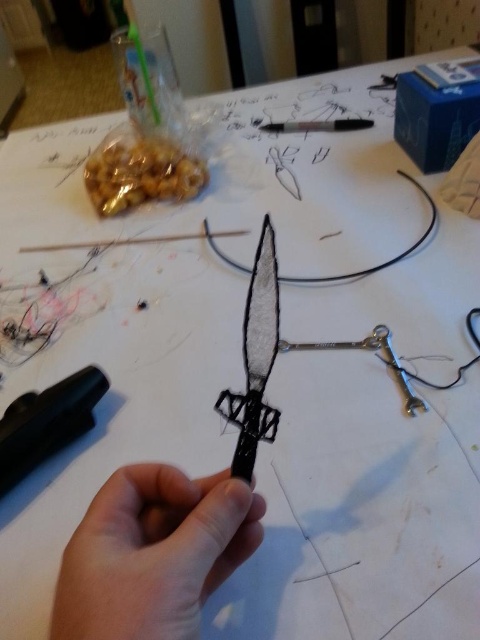
Question: Is smooth skin hand at center above black matte knife at center?

Choices:
 (A) yes
 (B) no

Answer: (B)

Question: Among these points, which one is nearest to the camera?

Choices:
 (A) (356, 118)
 (B) (252, 433)
 (C) (236, 531)
 (D) (282, 352)

Answer: (C)

Question: Which of these objects is positioned closest to the metallic silver scissors at center?

Choices:
 (A) black rubber pen at center
 (B) black matte knife at center
 (C) black plastic pen at center
 (D) smooth skin hand at center

Answer: (B)

Question: Considering the relative positions of smooth skin hand at center and black rubber pen at center in the image provided, where is smooth skin hand at center located with respect to black rubber pen at center?

Choices:
 (A) right
 (B) left

Answer: (A)

Question: Does black rubber pen at center appear over black plastic pen at center?

Choices:
 (A) yes
 (B) no

Answer: (B)

Question: Which of the following is the farthest from the observer?

Choices:
 (A) (96, 368)
 (B) (328, 131)
 (C) (85, 563)

Answer: (B)